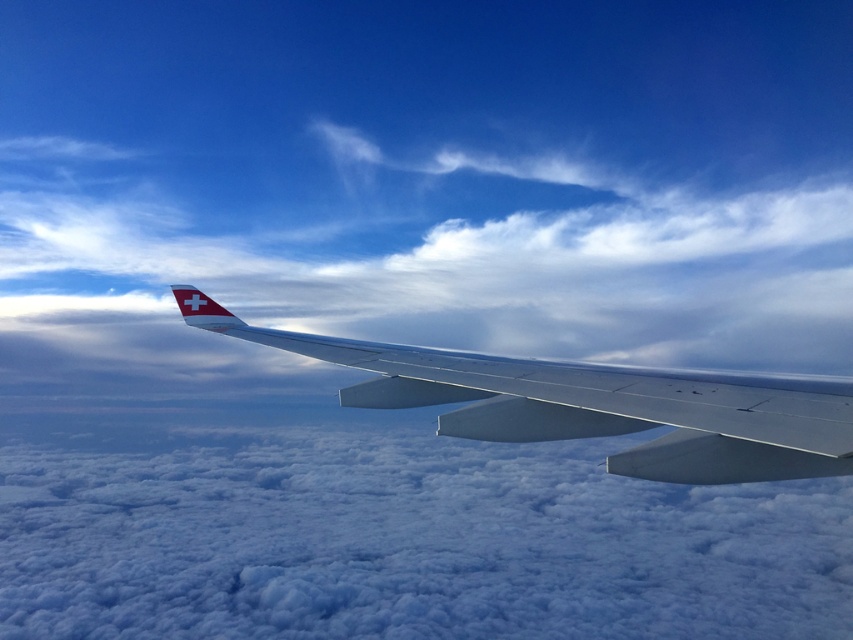
Consider the image. You are a pilot who needs to ensure there is enough space between the metallic gray wing at center and the white fluffy cloud at center for safe passage. Given that the minimum required distance for safe flight is 100 meters, can you safely navigate between them?

The distance between the white fluffy cloud at center and metallic gray wing at center is 95.08 meters, which is less than the required 100 meters for safe passage. Therefore, navigating between them would not be safe.

You are a pilot who wants to ensure there is enough vertical space between the metallic gray wing at center and the white fluffy cloud at center to avoid collision. Based on the scene, what can you conclude about their vertical positions?

The white fluffy cloud at center is much taller than the metallic gray wing at center, meaning the cloud is above the wing. Therefore, there is sufficient vertical space between them to avoid collision.